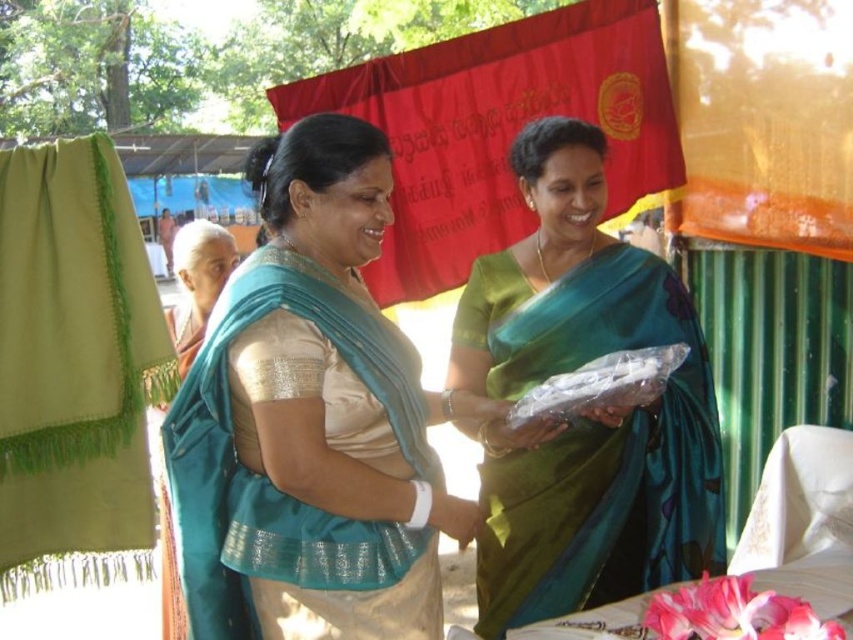
Which of these two, teal silk saree at center or red fabric canopy at upper center, stands taller?

red fabric canopy at upper center

Is point (410, 346) positioned after point (567, 36)?

That is False.

Where is `teal silk saree at center`? This screenshot has height=640, width=853. teal silk saree at center is located at coordinates (312, 419).

Can you confirm if green silk saree at center is positioned to the left of white embroidered tablecloth at lower right?

Correct, you'll find green silk saree at center to the left of white embroidered tablecloth at lower right.

Is point (640, 264) in front of point (801, 568)?

That is False.

The width and height of the screenshot is (853, 640). Identify the location of green silk saree at center. (587, 413).

Looking at this image, between teal silk saree at center and green silk saree at center, which one has less height?

teal silk saree at center

What do you see at coordinates (312, 419) in the screenshot? Image resolution: width=853 pixels, height=640 pixels. I see `teal silk saree at center` at bounding box center [312, 419].

You are a GUI agent. You are given a task and a screenshot of the screen. Output one action in this format:
    pyautogui.click(x=<x>, y=<y>)
    Task: Click on the teal silk saree at center
    This screenshot has height=640, width=853.
    Given the screenshot: What is the action you would take?
    pyautogui.click(x=312, y=419)